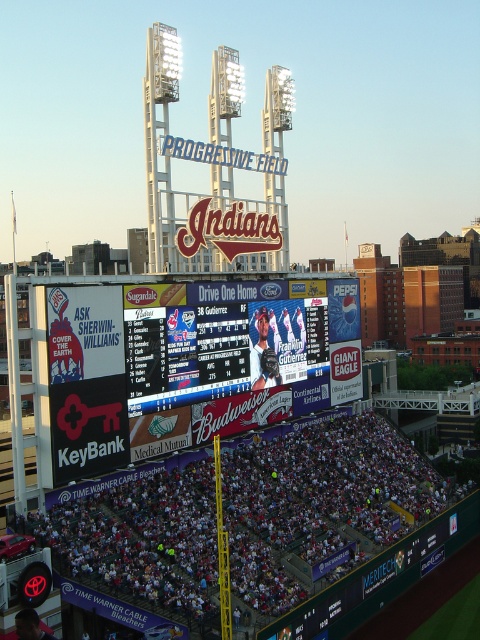
Question: Does white fabric crowd at lower center have a lesser width compared to white digital scoreboard at center?

Choices:
 (A) yes
 (B) no

Answer: (B)

Question: Does white fabric crowd at lower center appear under white digital scoreboard at center?

Choices:
 (A) no
 (B) yes

Answer: (B)

Question: From the image, what is the correct spatial relationship of white fabric crowd at lower center in relation to white digital scoreboard at center?

Choices:
 (A) right
 (B) left

Answer: (A)

Question: Which point is closer to the camera taking this photo?

Choices:
 (A) (175, 310)
 (B) (229, 548)

Answer: (B)

Question: Which object appears closest to the camera in this image?

Choices:
 (A) white fabric crowd at lower center
 (B) white digital scoreboard at center

Answer: (A)